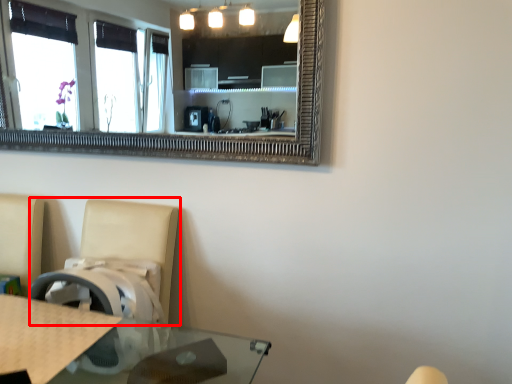
Question: Considering the relative positions of swivel chair (annotated by the red box) and counter top in the image provided, where is swivel chair (annotated by the red box) located with respect to the staircase?

Choices:
 (A) right
 (B) left

Answer: (A)